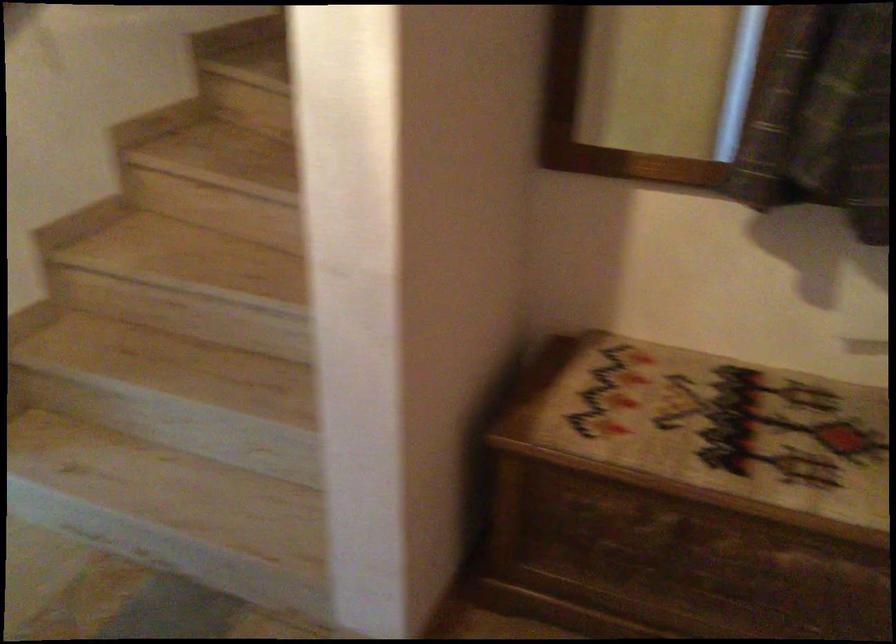
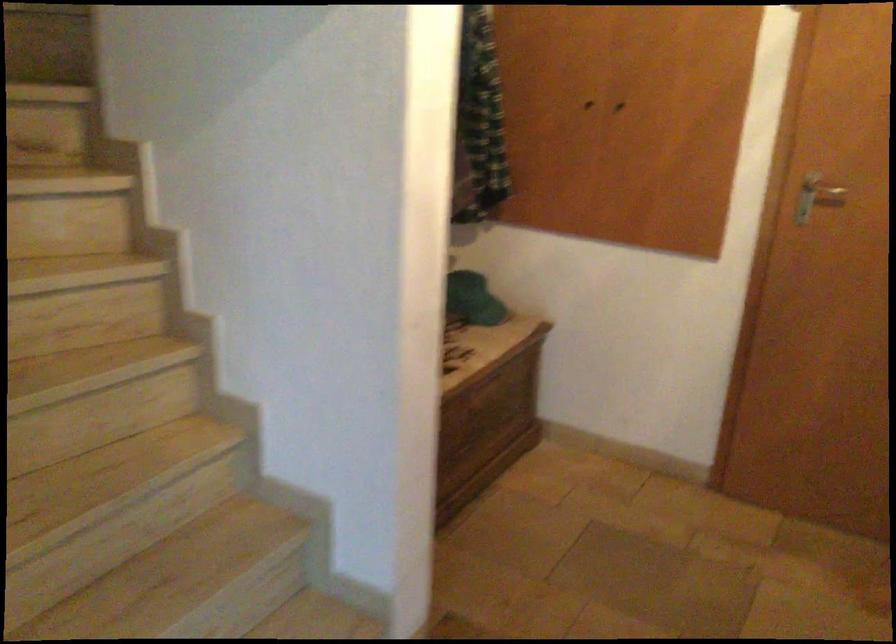
Question: I am providing you with two images of the same scene from different viewpoints. Please identify which objects are invisible in image2.

Choices:
 (A) green cap
 (B) silver door handle
 (C) wooden chest lid
 (D) small white card

Answer: (C)